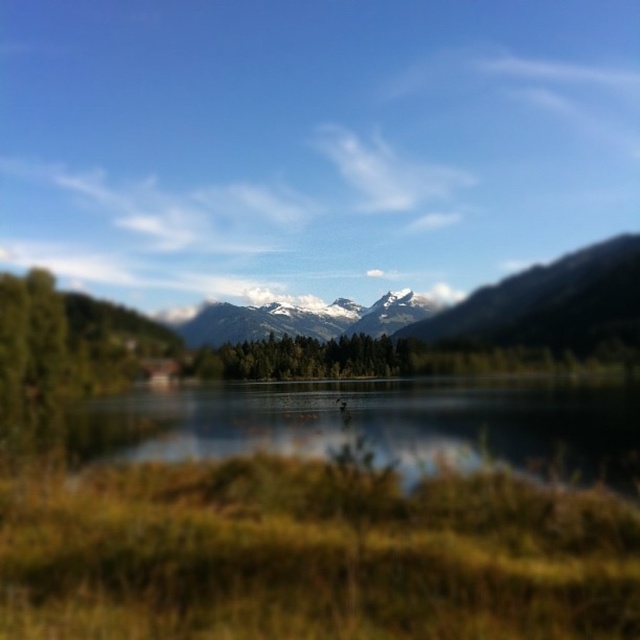
Consider the image. Is clear water at center bigger than snowy granite mountains at center?

Incorrect, clear water at center is not larger than snowy granite mountains at center.

Is point (502, 392) behind point (284, 330)?

No, (502, 392) is in front of (284, 330).

Where is `clear water at center`? clear water at center is located at coordinates (380, 422).

Is snowy granite mountains at center to the right of green matte trees at center from the viewer's perspective?

Yes, snowy granite mountains at center is to the right of green matte trees at center.

At what (x,y) coordinates should I click in order to perform the action: click on snowy granite mountains at center. Please return your answer as a coordinate pair (x, y). Looking at the image, I should click on (305, 320).

Is clear water at center thinner than green matte trees at center?

In fact, clear water at center might be wider than green matte trees at center.

Measure the distance between point (x=582, y=454) and camera.

101.36 feet

Locate an element on the screen. This screenshot has height=640, width=640. clear water at center is located at coordinates (380, 422).

Image resolution: width=640 pixels, height=640 pixels. I want to click on clear water at center, so click(x=380, y=422).